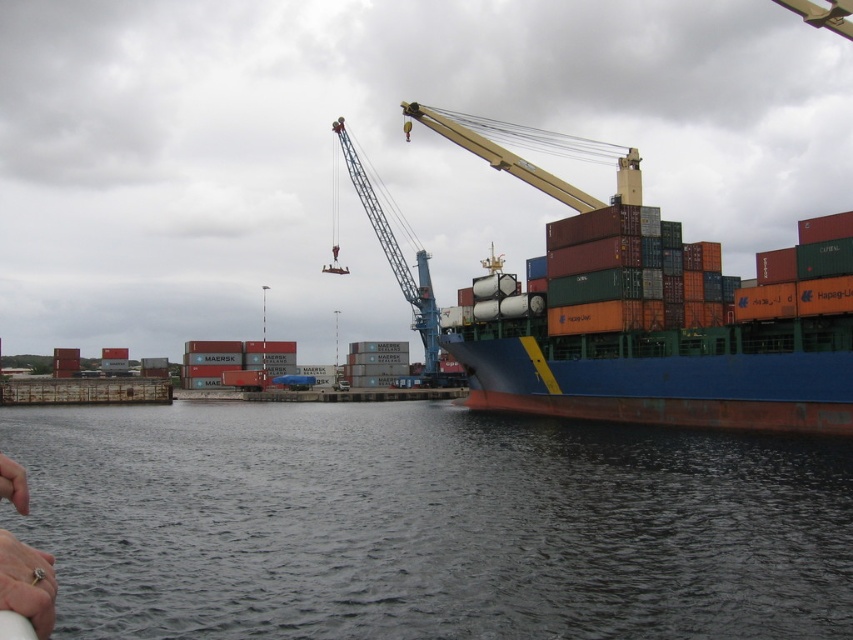
Question: Is silver metallic ring at lower left closer to camera compared to yellow metallic crane at upper center?

Choices:
 (A) yes
 (B) no

Answer: (A)

Question: Is dark gray water at center thinner than yellow metallic crane at upper center?

Choices:
 (A) no
 (B) yes

Answer: (A)

Question: Which point appears farthest from the camera in this image?

Choices:
 (A) (51, 563)
 (B) (434, 372)
 (C) (840, 308)

Answer: (B)

Question: Which point is farther to the camera?

Choices:
 (A) (18, 564)
 (B) (840, 401)
 (C) (341, 131)
 (D) (422, 561)

Answer: (C)

Question: Estimate the real-world distances between objects in this image. Which object is farther from the dark gray water at center?

Choices:
 (A) blue matte container ship at center
 (B) yellow metallic crane at upper center

Answer: (B)

Question: Can you confirm if dark gray water at center is bigger than silver metallic ring at lower left?

Choices:
 (A) yes
 (B) no

Answer: (A)